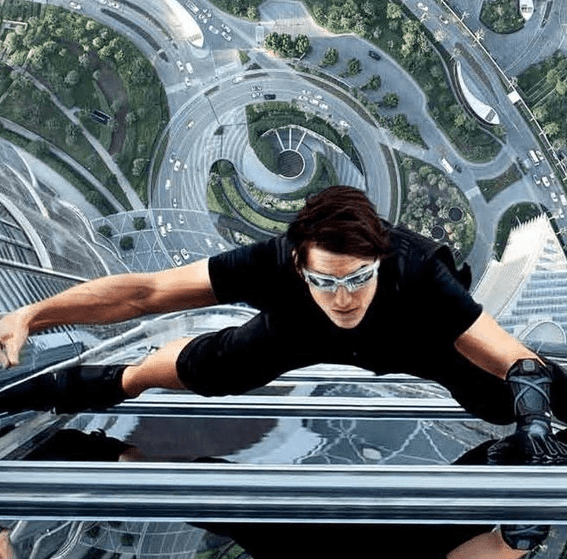
Locate an element on the screen. The height and width of the screenshot is (559, 567). silver ledge is located at coordinates (311, 490).